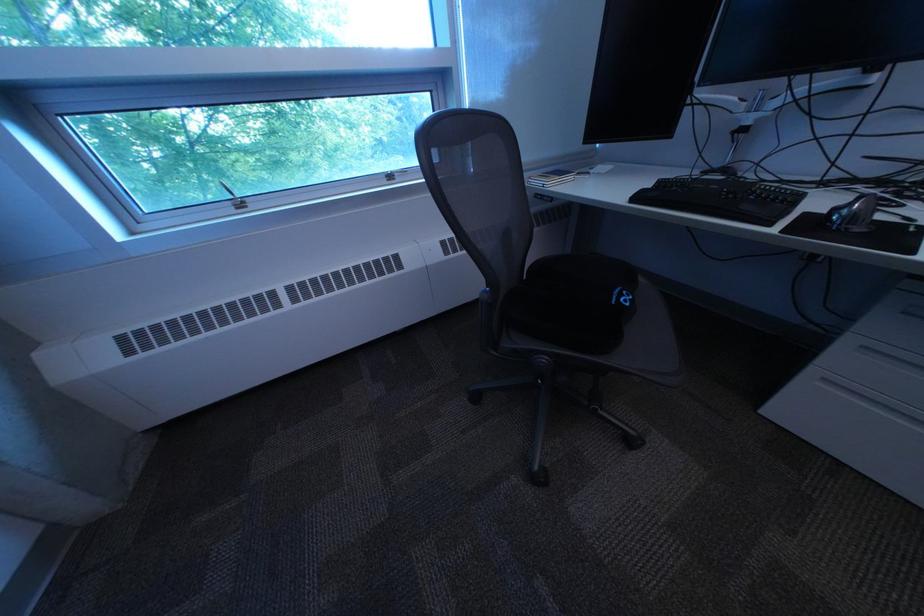
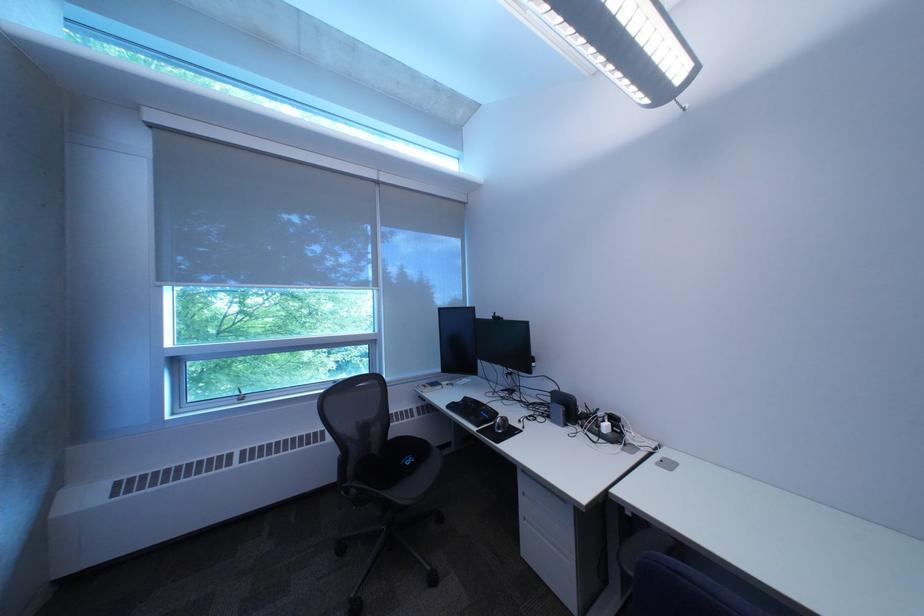
Where in the second image is the point corresponding to point (784, 227) from the first image?

(492, 429)